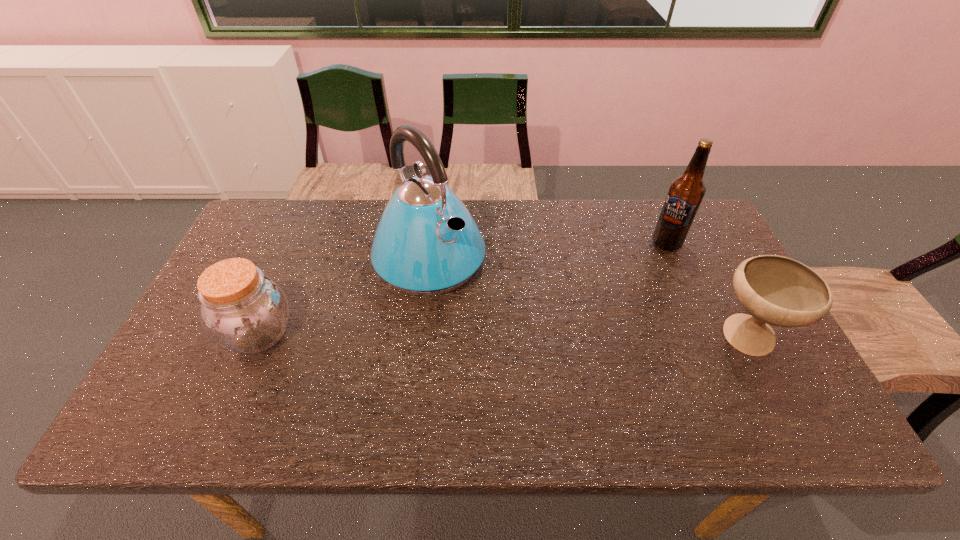
At what (x,y) coordinates should I click in order to perform the action: click on object that is at the near left corner. Please return your answer as a coordinate pair (x, y). This screenshot has width=960, height=540. Looking at the image, I should click on (243, 310).

Locate an element on the screen. object that is at the far right corner is located at coordinates (686, 192).

Locate an element on the screen. Image resolution: width=960 pixels, height=540 pixels. object positioned at the near right corner is located at coordinates (776, 290).

This screenshot has height=540, width=960. Find the location of `vacant area at the far edge of the desktop`. vacant area at the far edge of the desktop is located at coordinates click(501, 230).

This screenshot has height=540, width=960. In the image, there is a desktop. Find the location of `vacant space at the near edge`. vacant space at the near edge is located at coordinates (256, 392).

The width and height of the screenshot is (960, 540). Find the location of `vacant space at the far left corner of the desktop`. vacant space at the far left corner of the desktop is located at coordinates (253, 234).

Find the location of a particular element. The width and height of the screenshot is (960, 540). free space at the near right corner is located at coordinates (767, 381).

You are a GUI agent. You are given a task and a screenshot of the screen. Output one action in this format:
    pyautogui.click(x=<x>, y=<y>)
    Task: Click on the free space between the chalice and the tallest object
    The height and width of the screenshot is (540, 960).
    Given the screenshot: What is the action you would take?
    pyautogui.click(x=588, y=300)

You are a GUI agent. You are given a task and a screenshot of the screen. Output one action in this format:
    pyautogui.click(x=<x>, y=<y>)
    Task: Click on the blank region between the tallest object and the jar
    This screenshot has width=960, height=540.
    Given the screenshot: What is the action you would take?
    pyautogui.click(x=345, y=297)

Locate an element on the screen. vacant region between the leftmost object and the second tallest object is located at coordinates (463, 288).